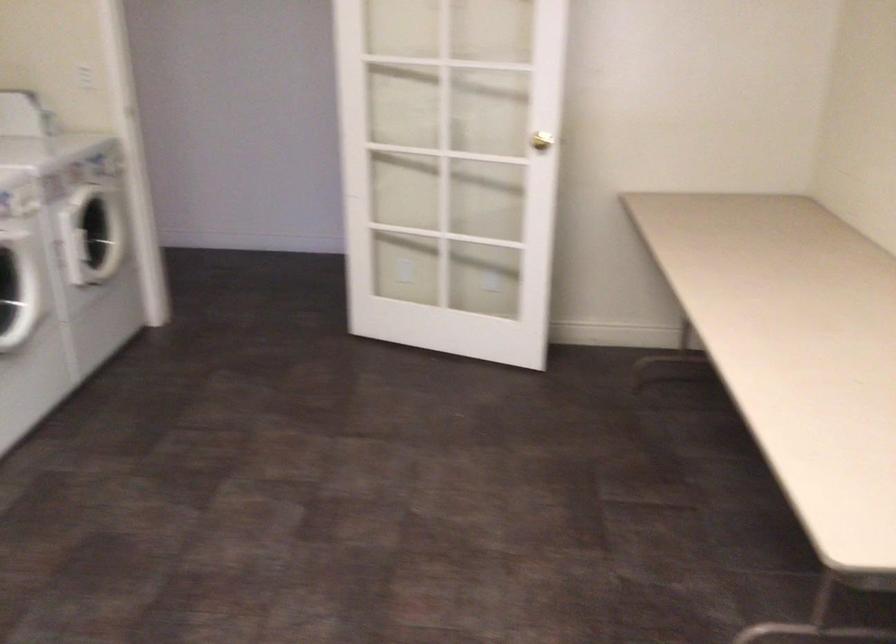
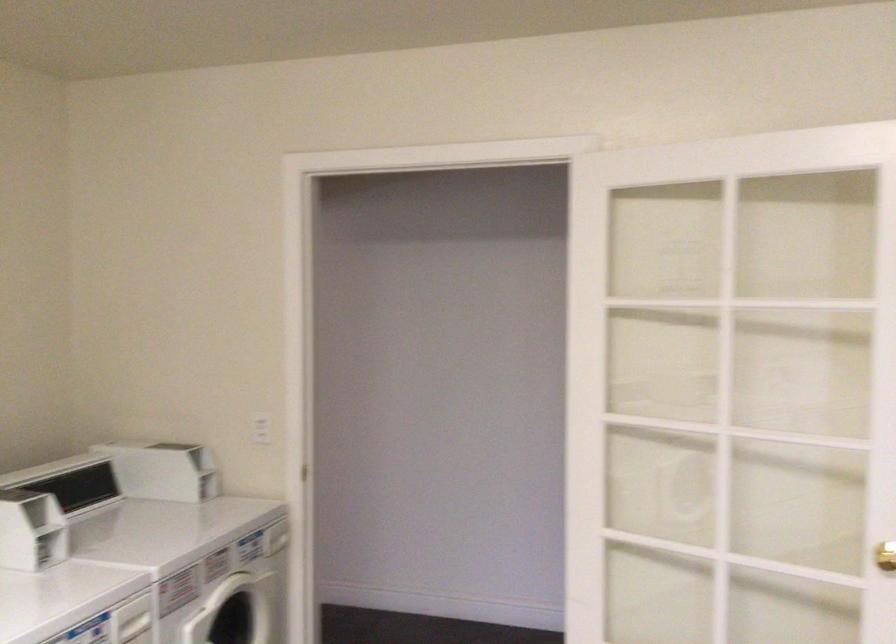
Where in the second image is the point corresponding to the point at 547,147 from the first image?

(885, 556)